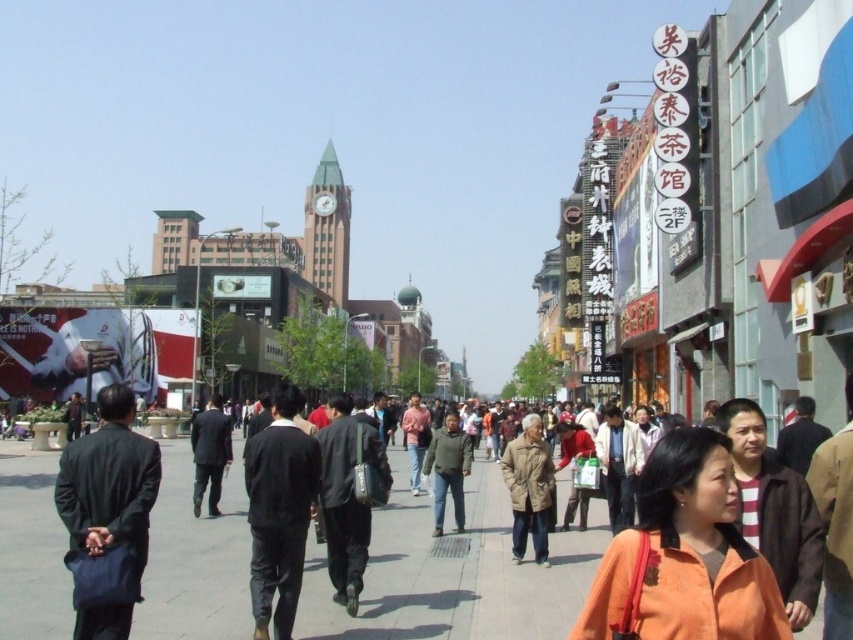
Looking at this image, you are a delivery person standing on the pedestrian walkway in the urban street scene. You need to deliver a package to the Wu Yu Tai Tea House located on the second floor of the building on the right. There are two coats in your way at the center of the walkway. The black leather jacket at center and the tan fabric coat at center. If you want to walk straight towards the tea house, will you have enough space to pass between them without touching the coats?

The black leather jacket at center and the tan fabric coat at center are 10.77 meters apart. Since the distance between them is more than sufficient for a person to pass through comfortably, you will have enough space to walk straight towards the tea house without touching the coats.

You are a photographer standing on the bustling urban street scene in China. You notice a person wearing a black matte jacket at center and another wearing a dark gray suit at center. Which clothing item would block your view more if they were standing directly in front of you?

The black matte jacket at center is bigger than the dark gray suit at center, so it would block your view more if they were standing directly in front of you.

You are a photographer standing in the bustling urban street scene. You want to take a photo of both the black matte jacket at center and the tan fabric coat at center. Which one should you focus on first to ensure both are in sharp focus?

You should focus on the black matte jacket at center first because it is closer to the viewer than the tan fabric coat at center. By focusing on the closer object, the depth of field may extend to include the tan fabric coat at center in acceptable focus.